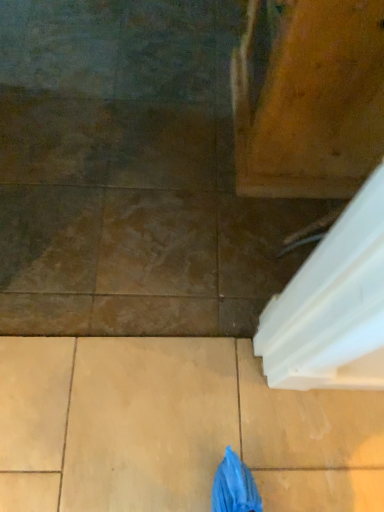
At what (x,y) coordinates should I click in order to perform the action: click on wooden cabinet at upper right. Please return your answer as a coordinate pair (x, y). This screenshot has width=384, height=512. Looking at the image, I should click on (308, 97).

Looking at this image, in order to face wooden cabinet at upper right, should I rotate leftwards or rightwards?

Rotate your view right by about 17.002°.

Image resolution: width=384 pixels, height=512 pixels. Describe the element at coordinates (308, 97) in the screenshot. I see `wooden cabinet at upper right` at that location.

Locate an element on the screen. The height and width of the screenshot is (512, 384). wooden cabinet at upper right is located at coordinates (308, 97).